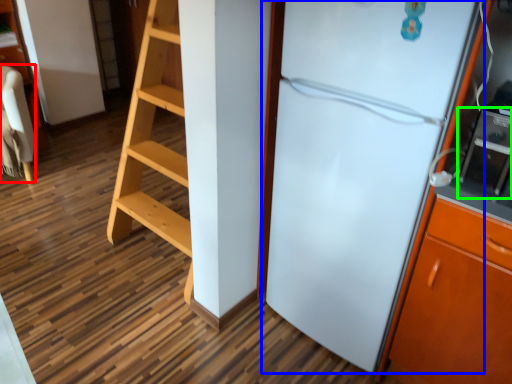
Question: Based on their relative distances, which object is nearer to furniture (highlighted by a red box)? Choose from refrigerator (highlighted by a blue box) and appliance (highlighted by a green box).

Choices:
 (A) refrigerator
 (B) appliance

Answer: (A)